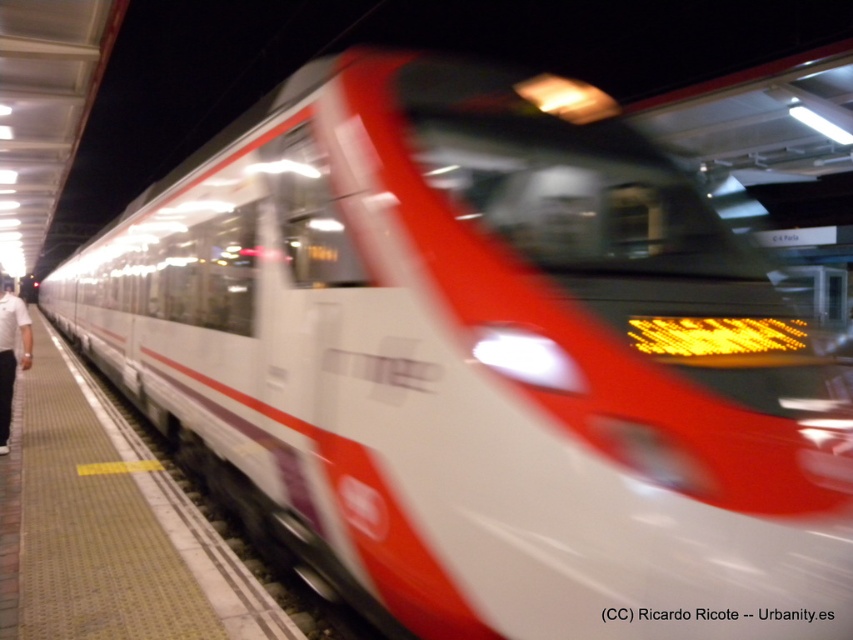
Image resolution: width=853 pixels, height=640 pixels. What do you see at coordinates (115, 528) in the screenshot?
I see `yellow textured platform at lower left` at bounding box center [115, 528].

Who is lower down, yellow textured platform at lower left or white cotton shirt at left?

Positioned lower is yellow textured platform at lower left.

Find the location of a particular element. The height and width of the screenshot is (640, 853). yellow textured platform at lower left is located at coordinates (115, 528).